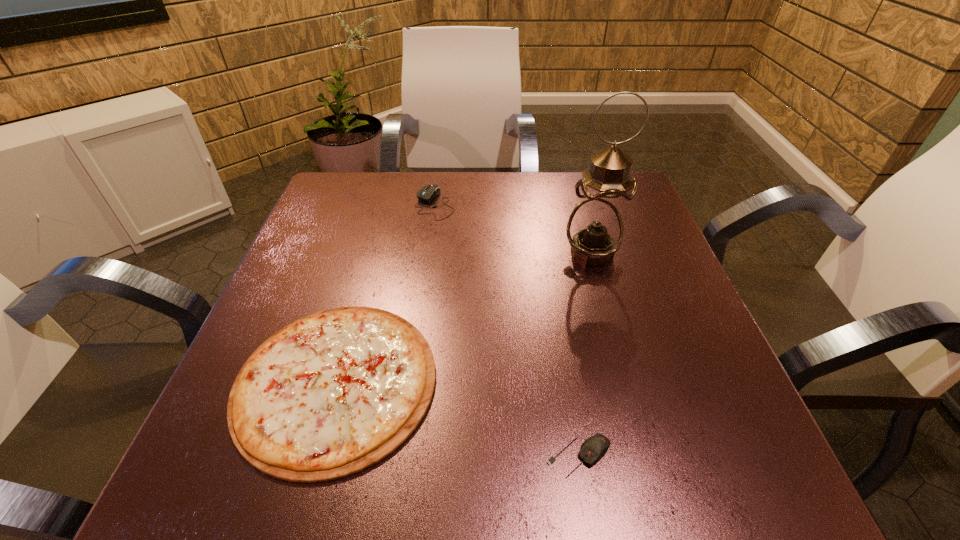
Where is `free point between the shorter mouse and the taller mouse`? free point between the shorter mouse and the taller mouse is located at coordinates (507, 330).

At what (x,y) coordinates should I click in order to perform the action: click on free point between the right mouse and the farthest object. Please return your answer as a coordinate pair (x, y). This screenshot has height=540, width=960. Looking at the image, I should click on (507, 330).

Locate an element on the screen. The width and height of the screenshot is (960, 540). free space between the shortest object and the oil lamp is located at coordinates (464, 317).

Image resolution: width=960 pixels, height=540 pixels. I want to click on object that is the third closest to the taller mouse, so click(595, 447).

The width and height of the screenshot is (960, 540). I want to click on object identified as the second closest to the tallest object, so click(333, 393).

This screenshot has width=960, height=540. I want to click on free space that satisfies the following two spatial constraints: 1. on the back side of the third nearest object; 2. on the right side of the pizza, so click(x=372, y=252).

Image resolution: width=960 pixels, height=540 pixels. Identify the location of blank area in the image that satisfies the following two spatial constraints: 1. on the front side of the pizza; 2. on the left side of the nearer mouse. (315, 457).

The height and width of the screenshot is (540, 960). What are the coordinates of `free space in the image that satisfies the following two spatial constraints: 1. on the back side of the tallest object; 2. on the left side of the pizza` in the screenshot? It's located at (372, 252).

Image resolution: width=960 pixels, height=540 pixels. Identify the location of vacant space that satisfies the following two spatial constraints: 1. on the front side of the tallest object; 2. on the left side of the farther mouse. (428, 252).